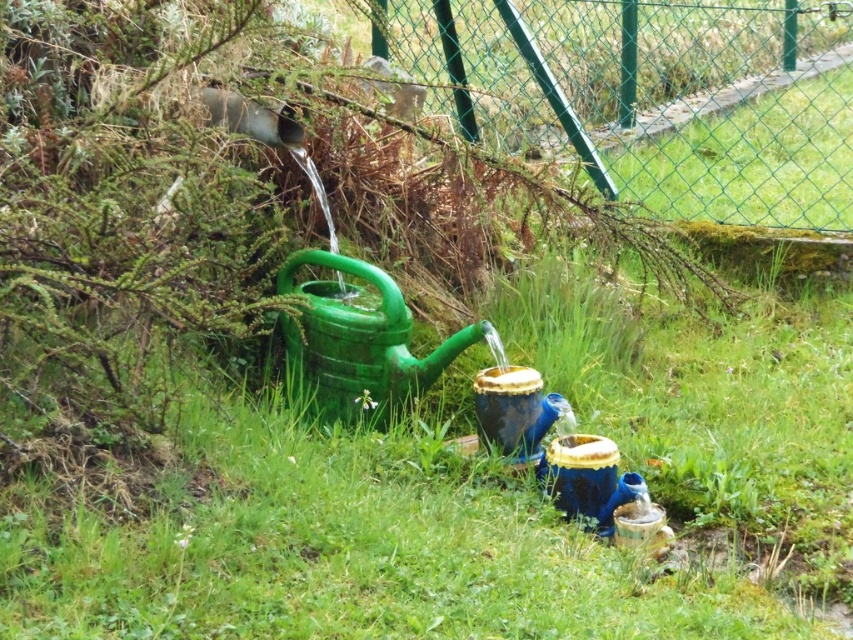
Question: Does green plastic watering can at center have a smaller size compared to blue glossy water at lower center?

Choices:
 (A) yes
 (B) no

Answer: (B)

Question: Can you confirm if green plastic watering can at center is positioned below blue glossy water at lower center?

Choices:
 (A) no
 (B) yes

Answer: (A)

Question: Which object appears farthest from the camera in this image?

Choices:
 (A) blue glossy water at lower center
 (B) green plastic watering can at center

Answer: (B)

Question: Which of the following is the farthest from the observer?

Choices:
 (A) blue glossy water at lower center
 (B) green plastic watering can at center

Answer: (B)

Question: Is the position of green plastic watering can at center more distant than that of blue glossy water at lower center?

Choices:
 (A) yes
 (B) no

Answer: (A)